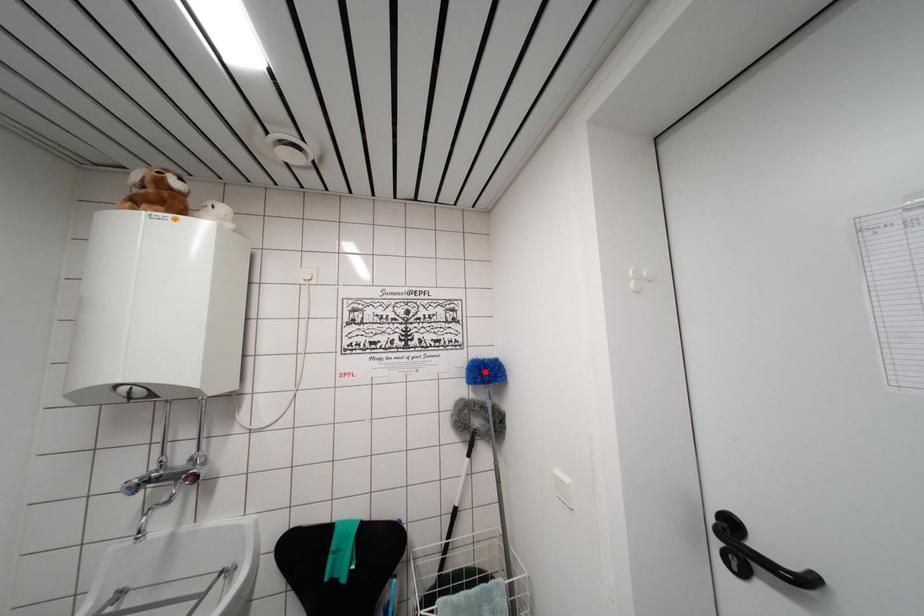
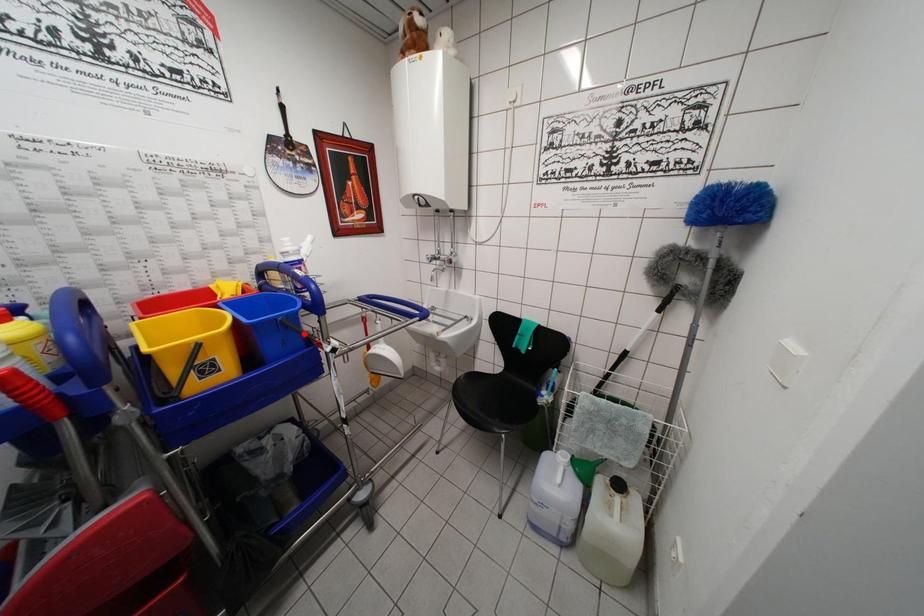
I am providing you with two images of the same scene from different viewpoints. A red point is marked on the first image and another point is marked on the second image. Do the highlighted points in image1 and image2 indicate the same real-world spot?

No